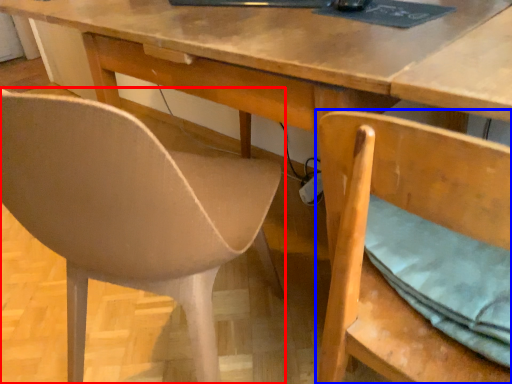
Question: Among these objects, which one is farthest to the camera, chair (highlighted by a red box) or chair (highlighted by a blue box)?

Choices:
 (A) chair
 (B) chair

Answer: (B)